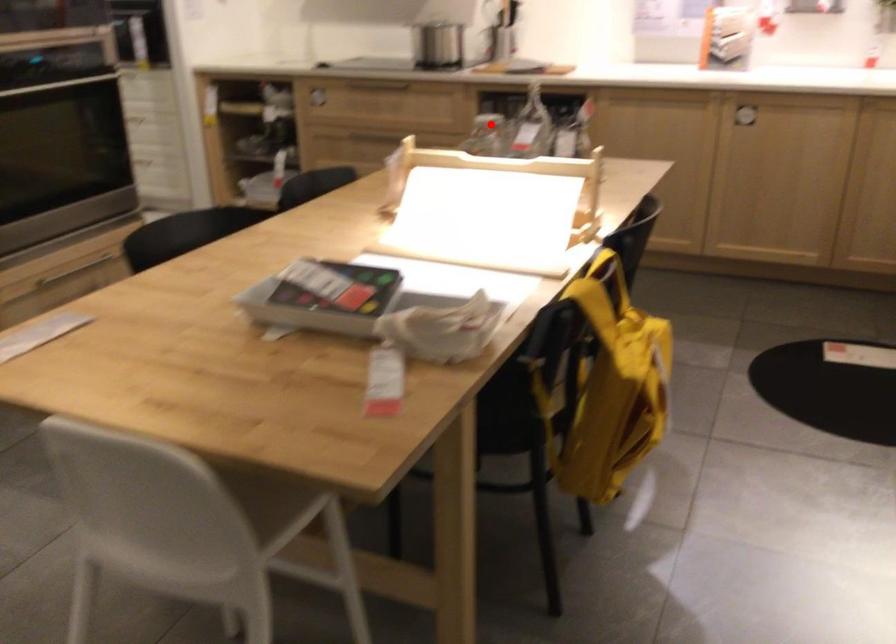
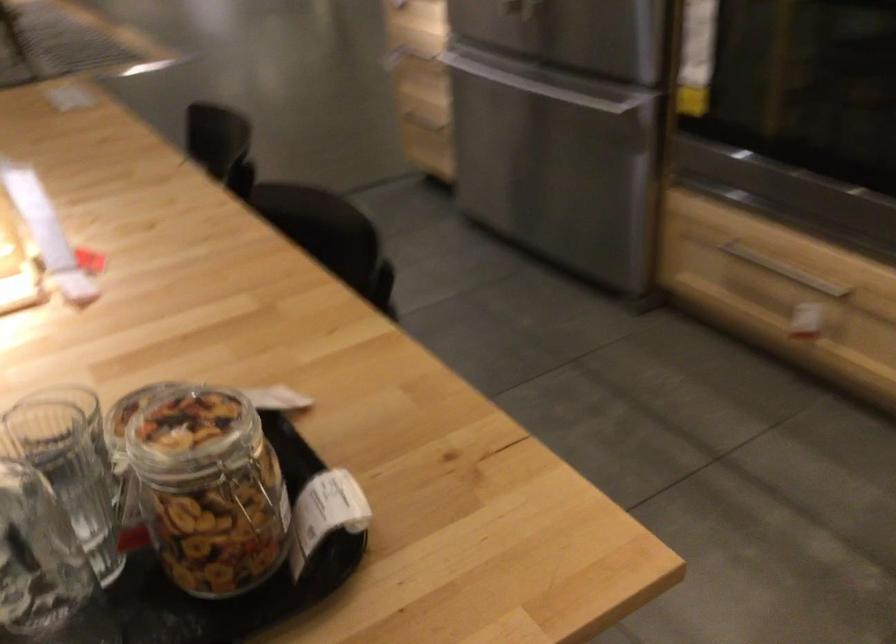
Where in the second image is the point corresponding to the highlighted location from the first image?

(209, 489)